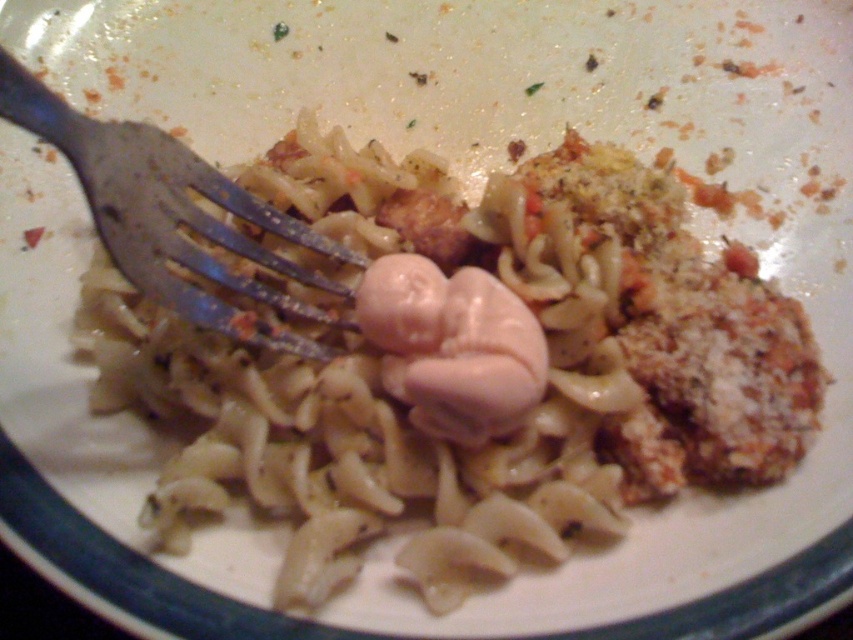
Can you confirm if metallic silver fork at left is positioned to the right of pink matte meat at center?

In fact, metallic silver fork at left is to the left of pink matte meat at center.

Does metallic silver fork at left have a larger size compared to pink matte meat at center?

Correct, metallic silver fork at left is larger in size than pink matte meat at center.

Is point (227, 237) closer to viewer compared to point (524, 372)?

No.

Find the location of a particular element. metallic silver fork at left is located at coordinates (170, 212).

Who is more forward, (202, 314) or (466, 256)?

Point (202, 314) is in front.

Where is `metallic silver fork at left`? metallic silver fork at left is located at coordinates (170, 212).

Between point (285, 260) and point (428, 237), which one is positioned behind?

Point (428, 237)

Image resolution: width=853 pixels, height=640 pixels. In order to click on metallic silver fork at left in this screenshot , I will do `click(170, 212)`.

Does pink matte meat at center appear on the left side of brown crispy meat at center?

Incorrect, pink matte meat at center is not on the left side of brown crispy meat at center.

Is pink matte meat at center smaller than brown crispy meat at center?

No.

Identify the location of pink matte meat at center. The width and height of the screenshot is (853, 640). (451, 346).